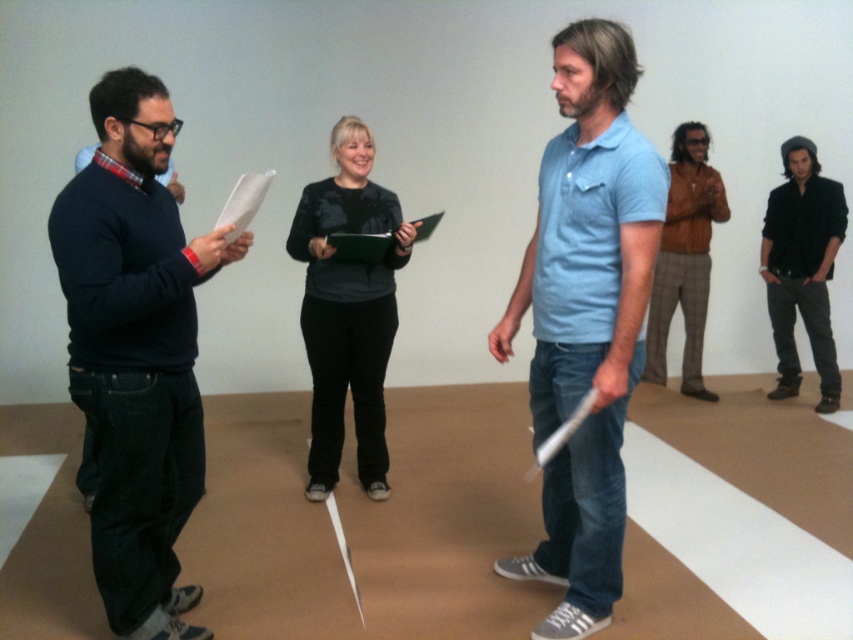
Is light blue cotton polo shirt at center positioned before black matte shirt at upper right?

Yes.

You are a GUI agent. You are given a task and a screenshot of the screen. Output one action in this format:
    pyautogui.click(x=<x>, y=<y>)
    Task: Click on the light blue cotton polo shirt at center
    The image size is (853, 640).
    Given the screenshot: What is the action you would take?
    pyautogui.click(x=585, y=317)

Does point (595, 566) come farther from viewer compared to point (799, 241)?

No, it is not.

I want to click on light blue cotton polo shirt at center, so click(x=585, y=317).

From the picture: Can you confirm if black matte shirt at upper right is smaller than brown leather jacket at right?

Yes.

Which is above, black matte shirt at upper right or brown leather jacket at right?

Positioned higher is brown leather jacket at right.

Image resolution: width=853 pixels, height=640 pixels. Identify the location of black matte shirt at upper right. (802, 268).

Which is in front, point (123, 349) or point (693, 312)?

Point (123, 349) is more forward.

Between matte black sweater at left and brown leather jacket at right, which one is positioned higher?

brown leather jacket at right is higher up.

Does point (161, 522) come in front of point (697, 134)?

Yes.

Locate an element on the screen. The width and height of the screenshot is (853, 640). matte black sweater at left is located at coordinates point(136,352).